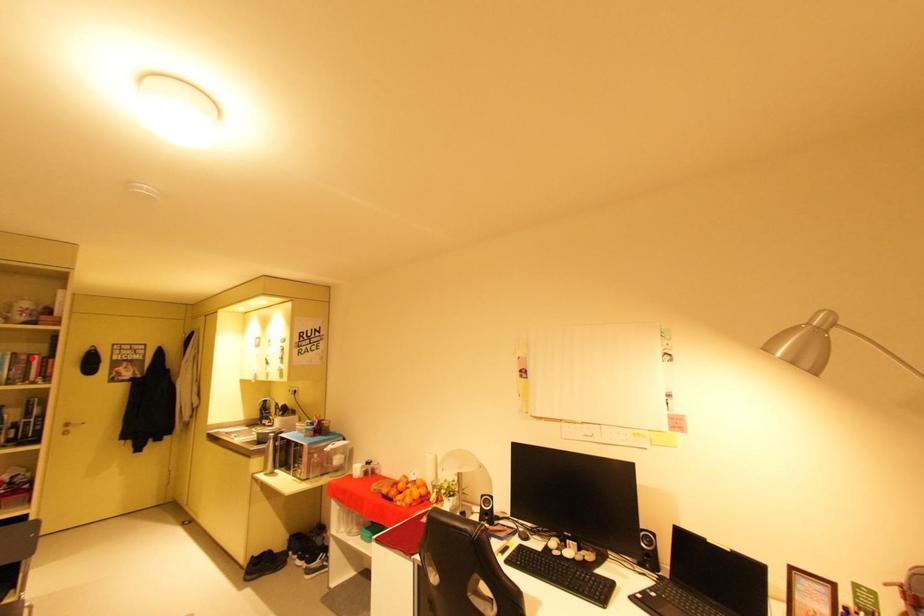
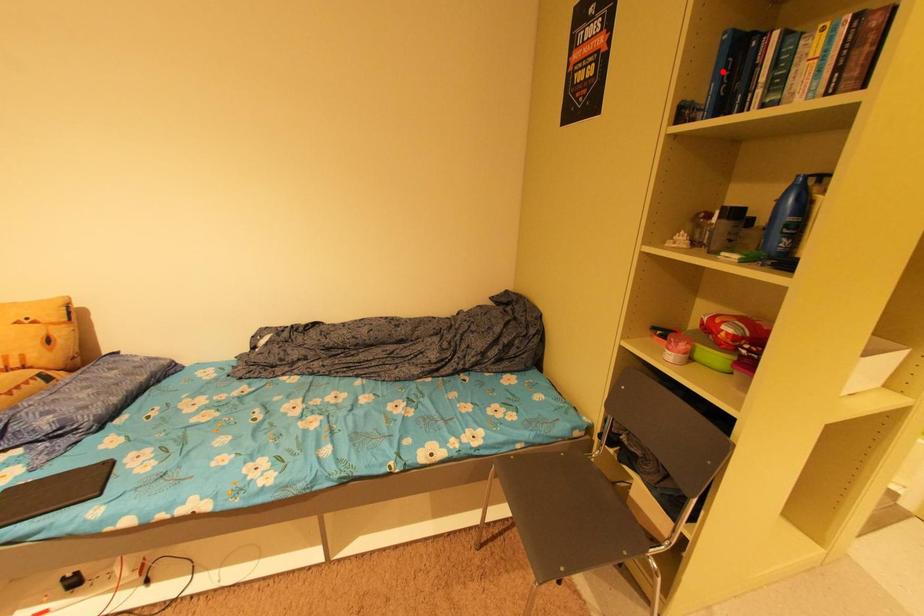
I am providing you with two images of the same scene from different viewpoints. A red point is marked on the first image and another point is marked on the second image. Do the highlighted points in image1 and image2 indicate the same real-world spot?

No